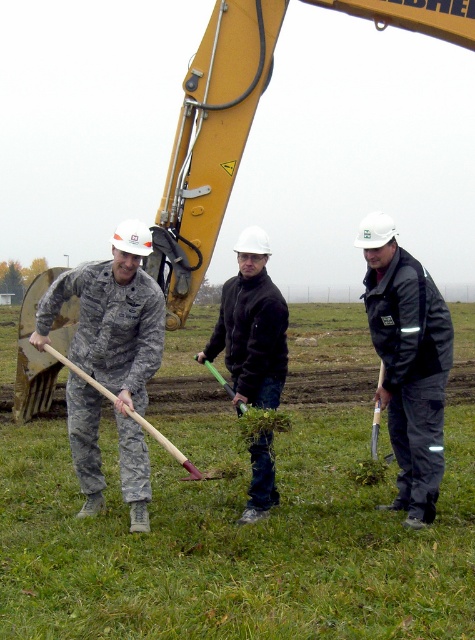
Question: Does black matte jacket at right appear on the left side of black matte jacket at center?

Choices:
 (A) no
 (B) yes

Answer: (A)

Question: Is green grass at center thinner than black matte jacket at right?

Choices:
 (A) no
 (B) yes

Answer: (A)

Question: Which is nearer to the green grass at center?

Choices:
 (A) black matte jacket at right
 (B) black matte jacket at center
 (C) wooden shovel at center
 (D) camouflage fabric soldier at left

Answer: (D)

Question: Which of the following is the closest to the observer?

Choices:
 (A) camouflage fabric soldier at left
 (B) black matte jacket at center
 (C) wooden shovel at center
 (D) black matte jacket at right

Answer: (A)

Question: Which of the following is the closest to the observer?

Choices:
 (A) black matte jacket at right
 (B) green grass at center

Answer: (B)

Question: In this image, where is black matte jacket at center located relative to green plastic shovel at center?

Choices:
 (A) below
 (B) above

Answer: (B)